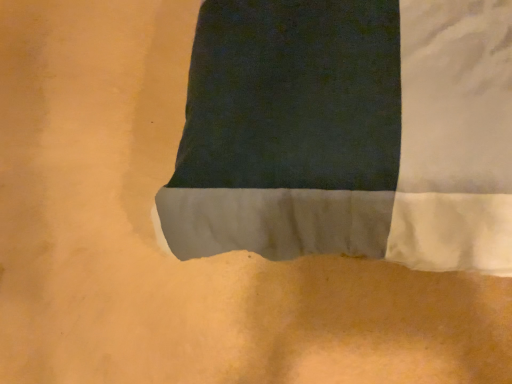
The height and width of the screenshot is (384, 512). Describe the element at coordinates (347, 133) in the screenshot. I see `dark fabric curtain at center` at that location.

Where is `dark fabric curtain at center`? Image resolution: width=512 pixels, height=384 pixels. dark fabric curtain at center is located at coordinates (347, 133).

What is the approximate width of dark fabric curtain at center?

dark fabric curtain at center is 1.53 meters in width.

Find the location of a particular element. Image resolution: width=512 pixels, height=384 pixels. dark fabric curtain at center is located at coordinates (347, 133).